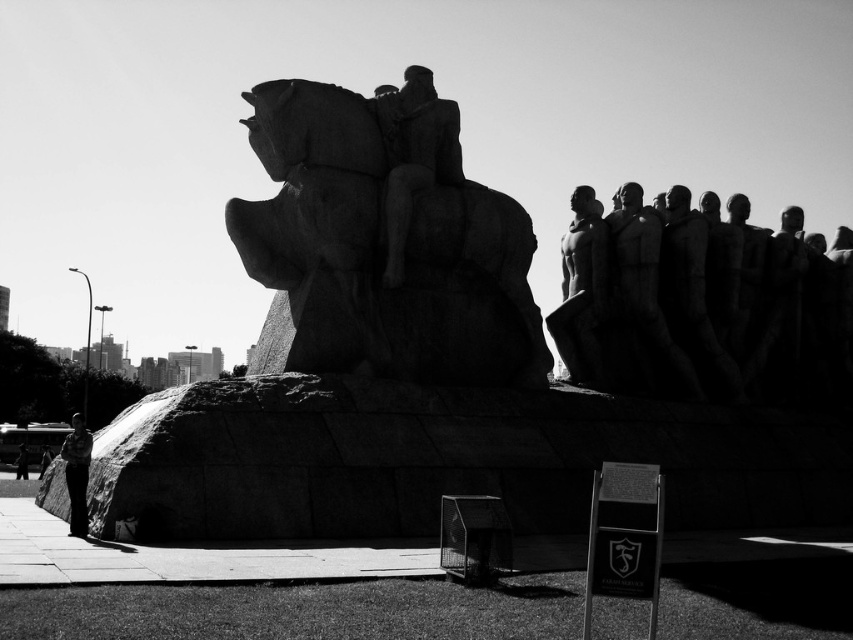
You are standing in front of the sculpture and see a point at coordinates [77,474]. Based on the scene description, where is this point located?

The point at [77,474] is located on the camouflage shirt at lower left.

You are a photographer trying to capture a clear shot of the sculpture. You notice a camouflage shirt at lower left and a dark skin human at lower left in the foreground. Which object is closer to the camera, based on their sizes?

The camouflage shirt at lower left is thinner than the dark skin human at lower left, so the camouflage shirt at lower left is closer to the camera.

You are a photographer trying to capture the entire sculpture and its base in one shot. You notice a camouflage shirt at lower left and a dark skin human at lower left in your frame. Which object should you move to ensure both the sculpture and the base are fully visible?

The camouflage shirt at lower left is smaller than the dark skin human at lower left, so moving the dark skin human at lower left would have a more significant impact on clearing the frame for the sculpture and its base.